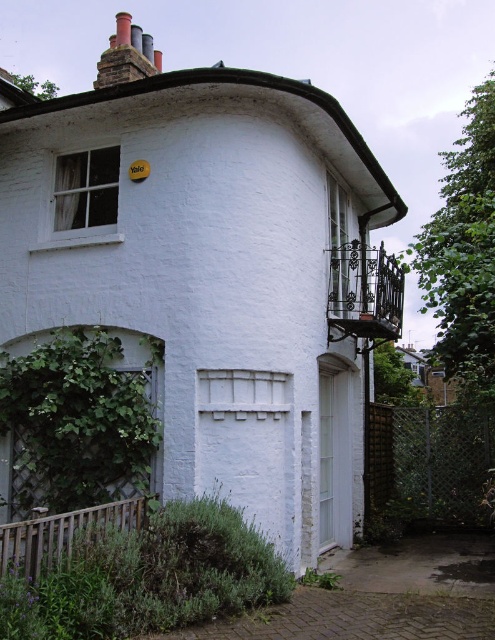
You are a gardener assessing the growth areas for plants on the building. Given the green leafy ivy at lower left and the smooth brick chimney at upper left, which area has more room for plant growth?

The smooth brick chimney at upper left has more room for plant growth since it occupies more space than the green leafy ivy at lower left.

You are standing in front of the white building and want to install a new security camera. The camera needs to be placed between the green leafy ivy at upper right and the smooth brick chimney at upper left. Based on their positions, which side of the building should you choose for the camera installation?

The green leafy ivy at upper right is to the right of the smooth brick chimney at upper left, so you should place the camera between them on the right side of the smooth brick chimney at upper left and the left side of the green leafy ivy at upper right.

You are standing in front of the building and want to know if the green leafy ivy at lower left is closer to you than the green leafy ivy at upper right. Can you determine this based on the scene?

The green leafy ivy at lower left is in front of green leafy ivy at upper right, so yes, it is closer to you.